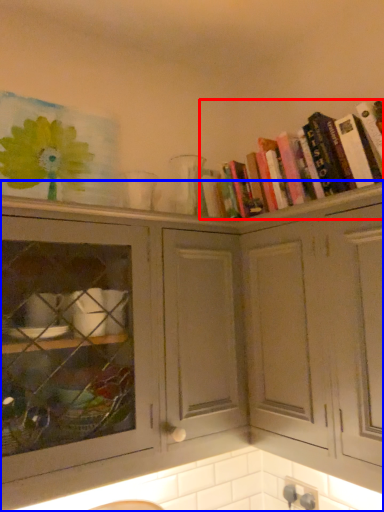
Question: Which of the following is the closest to the observer, book (highlighted by a red box) or cabinetry (highlighted by a blue box)?

Choices:
 (A) book
 (B) cabinetry

Answer: (B)